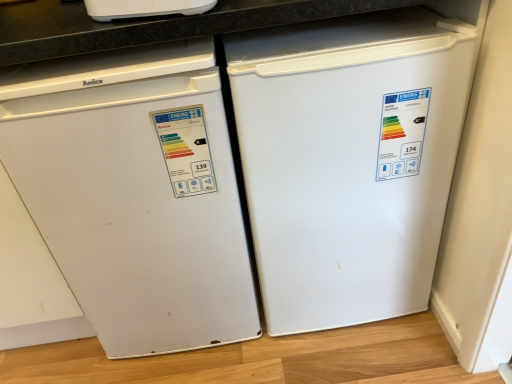
Question: Looking at their shapes, would you say white matte refrigerator at left is wider or thinner than white matte refrigerator at right?

Choices:
 (A) thin
 (B) wide

Answer: (A)

Question: Is white matte refrigerator at left in front of or behind white matte refrigerator at right in the image?

Choices:
 (A) behind
 (B) front

Answer: (B)

Question: From a real-world perspective, relative to white matte refrigerator at right, is white matte refrigerator at left vertically above or below?

Choices:
 (A) above
 (B) below

Answer: (A)

Question: From a real-world perspective, relative to white matte refrigerator at left, is white matte refrigerator at right vertically above or below?

Choices:
 (A) above
 (B) below

Answer: (B)

Question: Looking at their shapes, would you say white matte refrigerator at right is wider or thinner than white matte refrigerator at left?

Choices:
 (A) wide
 (B) thin

Answer: (A)

Question: Considering the positions of white matte refrigerator at right and white matte refrigerator at left in the image, is white matte refrigerator at right bigger or smaller than white matte refrigerator at left?

Choices:
 (A) big
 (B) small

Answer: (A)

Question: Is white matte refrigerator at right inside the boundaries of white matte refrigerator at left, or outside?

Choices:
 (A) outside
 (B) inside

Answer: (A)